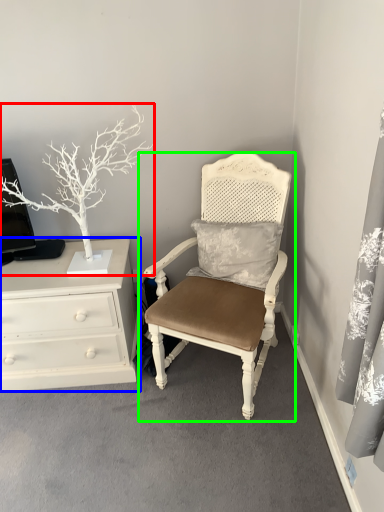
Question: Which object is the closest to the houseplant (highlighted by a red box)? Choose among these: chest of drawers (highlighted by a blue box) or chair (highlighted by a green box).

Choices:
 (A) chest of drawers
 (B) chair

Answer: (A)